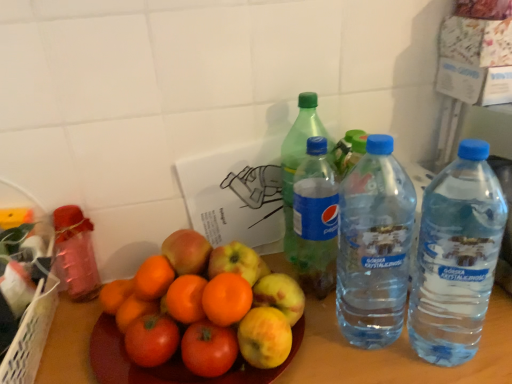
Question: Is metallic pink bottle at left, which appears as the fifth bottle when viewed from the right, beside orange matte at center?

Choices:
 (A) no
 (B) yes

Answer: (A)

Question: Is metallic pink bottle at left, which appears as the fifth bottle when viewed from the right, completely or partially outside of orange matte at center?

Choices:
 (A) yes
 (B) no

Answer: (A)

Question: Is metallic pink bottle at left, which is counted as the 1th bottle, starting from the left, oriented away from orange matte at center?

Choices:
 (A) no
 (B) yes

Answer: (A)

Question: Can you confirm if metallic pink bottle at left, which appears as the fifth bottle when viewed from the right, is thinner than orange matte at center?

Choices:
 (A) yes
 (B) no

Answer: (A)

Question: Considering the relative sizes of metallic pink bottle at left, which appears as the fifth bottle when viewed from the right, and orange matte at center in the image provided, is metallic pink bottle at left, which appears as the fifth bottle when viewed from the right, smaller than orange matte at center?

Choices:
 (A) yes
 (B) no

Answer: (A)

Question: Is green plastic bottle at center, the 3th bottle viewed from the left, taller or shorter than clear plastic water bottle at right, placed as the 2th bottle when sorted from right to left?

Choices:
 (A) tall
 (B) short

Answer: (B)

Question: Is green plastic bottle at center, the 3th bottle viewed from the left, in front of or behind clear plastic water bottle at right, arranged as the 4th bottle when viewed from the left, in the image?

Choices:
 (A) front
 (B) behind

Answer: (B)

Question: From a real-world perspective, is green plastic bottle at center, arranged as the third bottle when viewed from the right, physically located above or below clear plastic water bottle at right, arranged as the 4th bottle when viewed from the left?

Choices:
 (A) below
 (B) above

Answer: (A)

Question: Considering the positions of green plastic bottle at center, arranged as the third bottle when viewed from the right, and clear plastic water bottle at right, placed as the 2th bottle when sorted from right to left, in the image, is green plastic bottle at center, arranged as the third bottle when viewed from the right, wider or thinner than clear plastic water bottle at right, placed as the 2th bottle when sorted from right to left,?

Choices:
 (A) wide
 (B) thin

Answer: (B)

Question: From their relative heights in the image, would you say clear plastic water bottle at right, arranged as the 4th bottle when viewed from the left, is taller or shorter than orange matte at center?

Choices:
 (A) short
 (B) tall

Answer: (B)

Question: Considering the relative positions of clear plastic water bottle at right, arranged as the 4th bottle when viewed from the left, and orange matte at center in the image provided, is clear plastic water bottle at right, arranged as the 4th bottle when viewed from the left, to the left or to the right of orange matte at center?

Choices:
 (A) left
 (B) right

Answer: (B)

Question: Is clear plastic water bottle at right, placed as the 2th bottle when sorted from right to left, inside or outside of orange matte at center?

Choices:
 (A) outside
 (B) inside

Answer: (A)

Question: In terms of size, does clear plastic water bottle at right, placed as the 2th bottle when sorted from right to left, appear bigger or smaller than orange matte at center?

Choices:
 (A) small
 (B) big

Answer: (B)

Question: From the image's perspective, is metallic pink bottle at left, which is counted as the 1th bottle, starting from the left, above or below orange matte at center?

Choices:
 (A) below
 (B) above

Answer: (B)

Question: From a real-world perspective, relative to orange matte at center, is metallic pink bottle at left, which appears as the fifth bottle when viewed from the right, vertically above or below?

Choices:
 (A) above
 (B) below

Answer: (A)